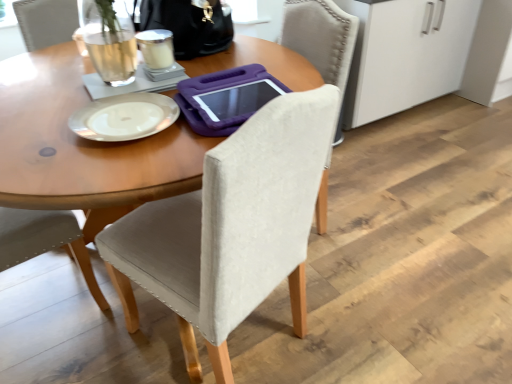
Question: Is point (132, 301) positioned closer to the camera than point (221, 23)?

Choices:
 (A) closer
 (B) farther

Answer: (A)

Question: Is beige fabric chair at center inside the boundaries of black leather handbag at upper center, or outside?

Choices:
 (A) inside
 (B) outside

Answer: (B)

Question: Which of these objects is positioned closest to the black leather handbag at upper center?

Choices:
 (A) white glossy plate at upper center
 (B) white frosted glass at upper center
 (C) beige fabric chair at center

Answer: (B)

Question: Considering the real-world distances, which object is closest to the white glossy plate at upper center?

Choices:
 (A) white frosted glass at upper center
 (B) beige fabric chair at center
 (C) black leather handbag at upper center

Answer: (A)